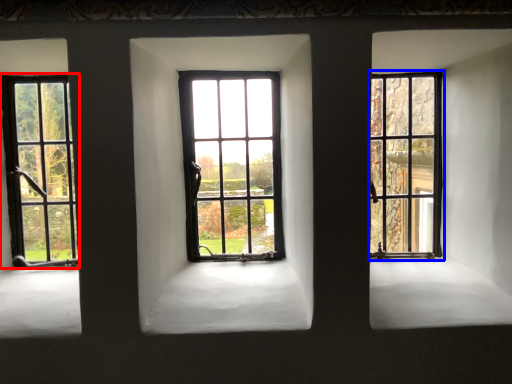
Question: Which of the following is the closest to the observer, window (highlighted by a red box) or window (highlighted by a blue box)?

Choices:
 (A) window
 (B) window

Answer: (A)